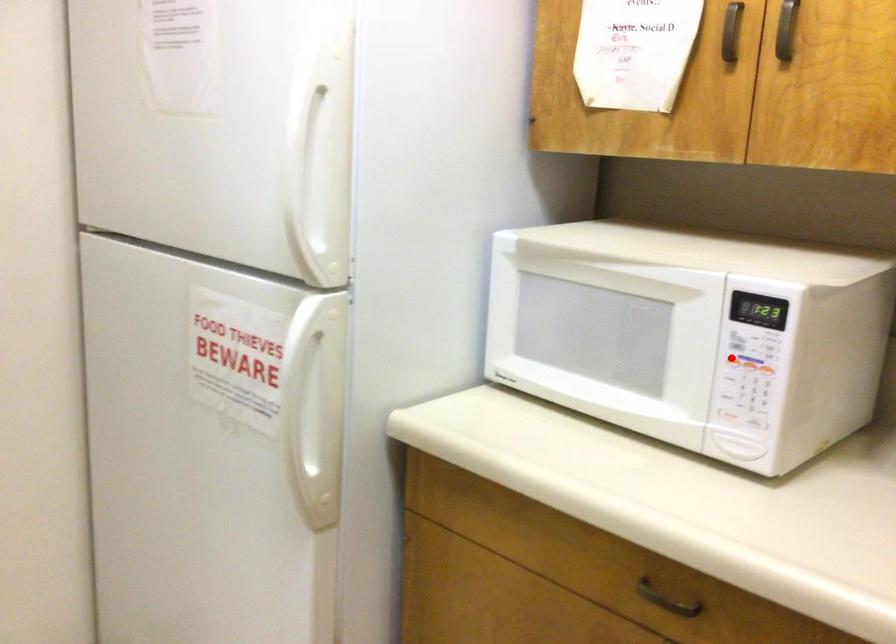
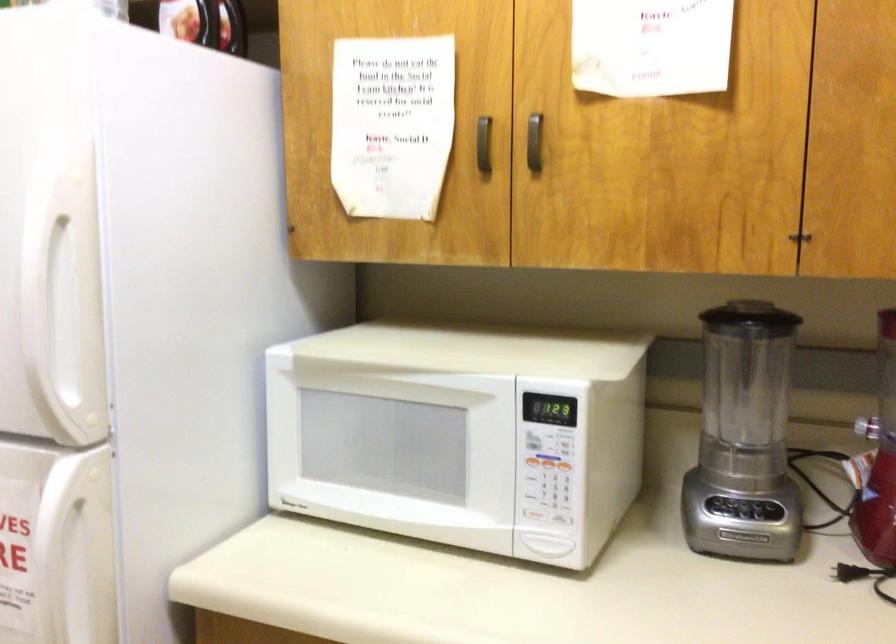
Locate, in the second image, the point that corresponds to the highlighted location in the first image.

(530, 462)